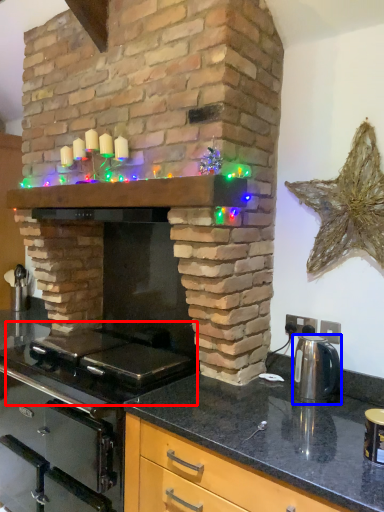
Question: Which object is further to the camera taking this photo, gas stove (highlighted by a red box) or kitchen appliance (highlighted by a blue box)?

Choices:
 (A) gas stove
 (B) kitchen appliance

Answer: (B)